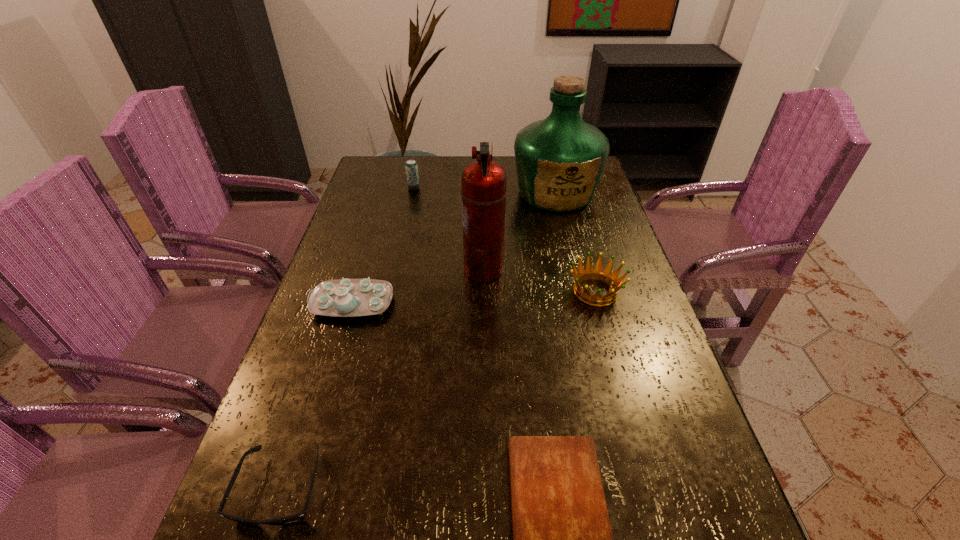
Where is `vacant region located 0.320m on the front of the beer can`? The width and height of the screenshot is (960, 540). vacant region located 0.320m on the front of the beer can is located at coordinates (400, 250).

The image size is (960, 540). What are the coordinates of `vacant space located 0.290m on the back of the chinaware` in the screenshot? It's located at (377, 221).

Identify the location of vacant space located 0.070m on the front of the crown. Image resolution: width=960 pixels, height=540 pixels. (608, 334).

I want to click on liquor present at the far edge, so click(x=559, y=160).

Where is `beer can present at the far edge`? The width and height of the screenshot is (960, 540). beer can present at the far edge is located at coordinates (411, 167).

At what (x,y) coordinates should I click in order to perform the action: click on chinaware that is at the left edge. Please return your answer as a coordinate pair (x, y). Image resolution: width=960 pixels, height=540 pixels. Looking at the image, I should click on (345, 297).

The height and width of the screenshot is (540, 960). I want to click on sunglasses that is positioned at the left edge, so click(x=298, y=517).

Where is `liquor situated at the right edge`? The height and width of the screenshot is (540, 960). liquor situated at the right edge is located at coordinates (559, 160).

Where is `crown located at the right edge`? crown located at the right edge is located at coordinates (597, 273).

Identify the location of object present at the far right corner. (559, 160).